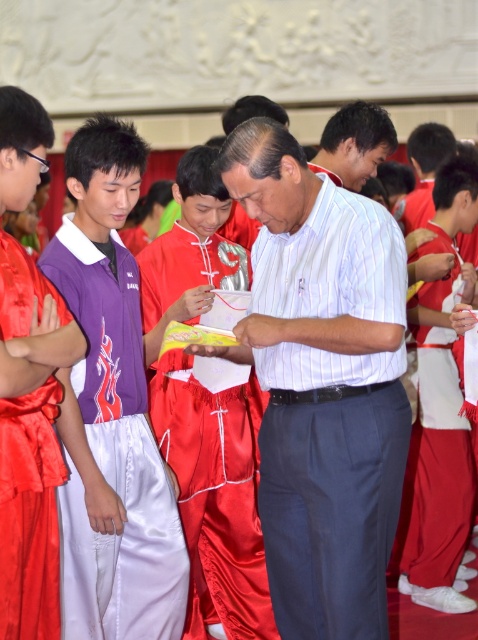
Does point (301, 486) come behind point (352, 180)?

No, (301, 486) is in front of (352, 180).

Can you confirm if white striped shirt at center is wider than matte white shirt at center?

Yes, white striped shirt at center is wider than matte white shirt at center.

Which is in front, point (397, 497) or point (367, 177)?

Point (397, 497)

You are a GUI agent. You are given a task and a screenshot of the screen. Output one action in this format:
    pyautogui.click(x=<x>, y=<y>)
    Task: Click on the white striped shirt at center
    Image resolution: width=478 pixels, height=640 pixels.
    Given the screenshot: What is the action you would take?
    pyautogui.click(x=322, y=385)

Does purple satin robe at left appear over silky red robe at left?

Incorrect, purple satin robe at left is not positioned above silky red robe at left.

Which of these two, purple satin robe at left or silky red robe at left, stands taller?

Standing taller between the two is purple satin robe at left.

This screenshot has height=640, width=478. I want to click on purple satin robe at left, so click(115, 460).

The image size is (478, 640). In order to click on purple satin robe at left in this screenshot , I will do `click(115, 460)`.

Can you confirm if silky red robe at left is taller than matte white shirt at center?

Indeed, silky red robe at left has a greater height compared to matte white shirt at center.

Describe the element at coordinates (30, 513) in the screenshot. This screenshot has height=640, width=478. I see `silky red robe at left` at that location.

Measure the distance between silky red robe at left and camera.

silky red robe at left is 20.93 meters from camera.

You are a GUI agent. You are given a task and a screenshot of the screen. Output one action in this format:
    pyautogui.click(x=<x>, y=<y>)
    Task: Click on the silky red robe at left
    The image size is (478, 640).
    Given the screenshot: What is the action you would take?
    pyautogui.click(x=30, y=513)